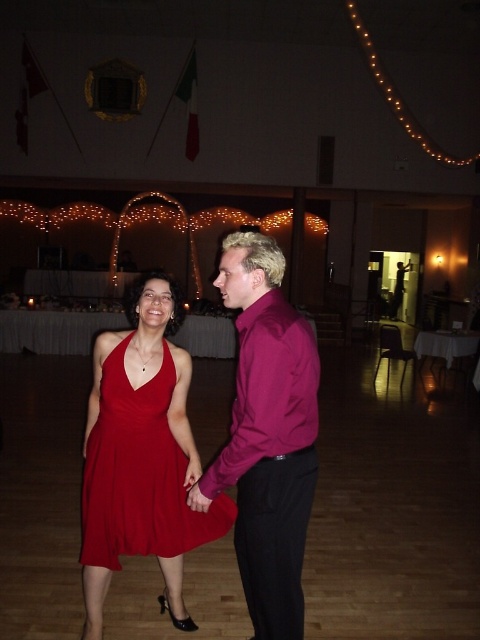
Question: Can you confirm if matte red dress at center is positioned to the left of purple satin shirt at center?

Choices:
 (A) yes
 (B) no

Answer: (A)

Question: Which object is positioned farthest from the shiny magenta shirt at center?

Choices:
 (A) matte red dress at center
 (B) purple satin shirt at center

Answer: (A)

Question: Which of these objects is positioned closest to the matte red dress at center?

Choices:
 (A) purple satin shirt at center
 (B) shiny magenta shirt at center

Answer: (B)

Question: Among these points, which one is nearest to the camera?

Choices:
 (A) (158, 481)
 (B) (316, 426)
 (C) (267, 282)

Answer: (C)

Question: Is matte red dress at center below purple satin shirt at center?

Choices:
 (A) yes
 (B) no

Answer: (A)

Question: Can you confirm if shiny magenta shirt at center is positioned to the left of purple satin shirt at center?

Choices:
 (A) no
 (B) yes

Answer: (B)